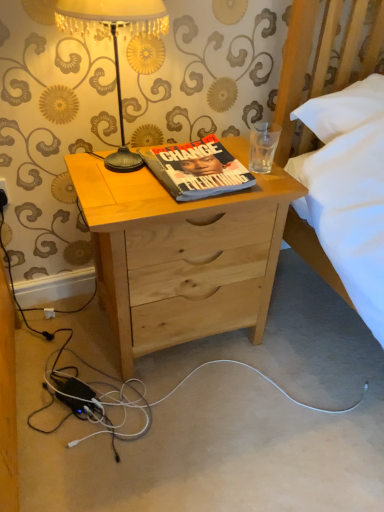
The width and height of the screenshot is (384, 512). In order to click on free spot above natural wood nightstand at center (from a real-world perspective) in this screenshot , I will do `click(178, 192)`.